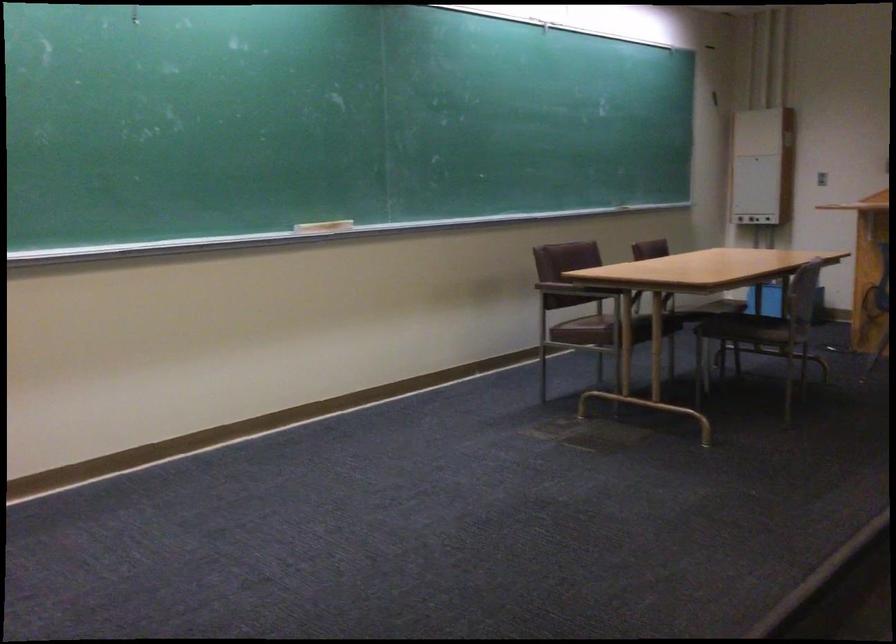
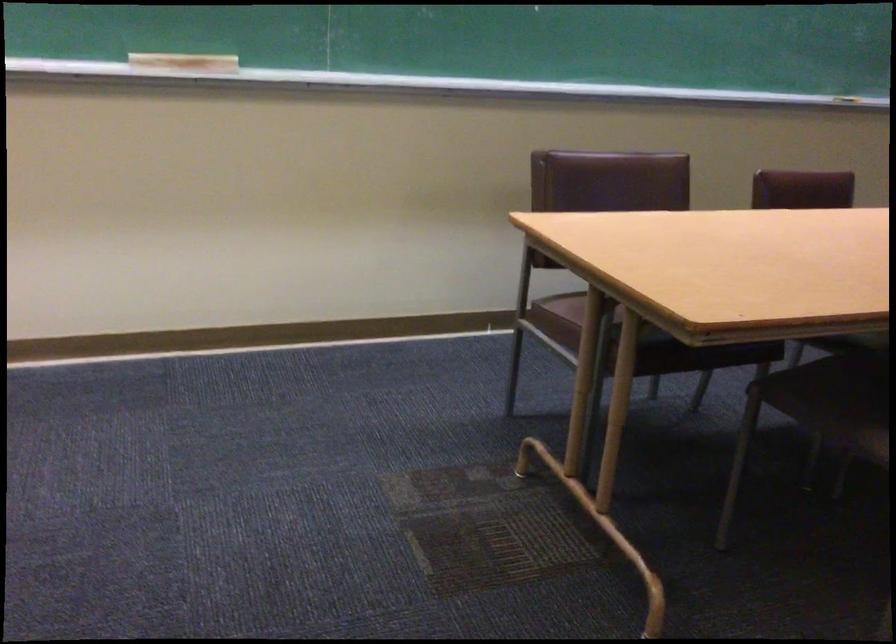
In the second image, find the point that corresponds to point (321, 222) in the first image.

(183, 64)